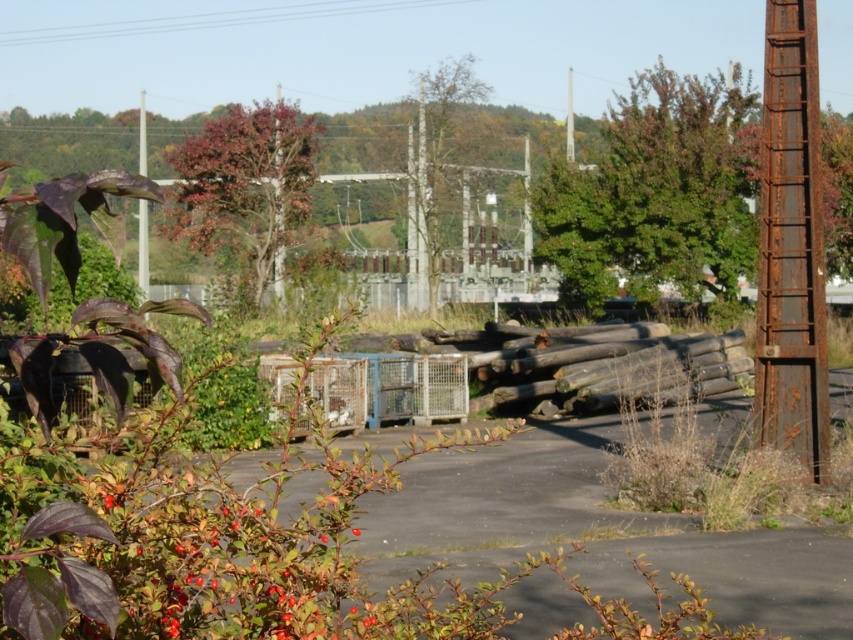
Question: Among these points, which one is farthest from the camera?

Choices:
 (A) (811, 76)
 (B) (233, 108)
 (C) (415, 246)

Answer: (B)

Question: Estimate the real-world distances between objects in this image. Which object is closer to the green leafy tree at center?

Choices:
 (A) rusty metal pole at left
 (B) green leafy tree at upper center
 (C) rusty metal pole at right

Answer: (B)

Question: Is reddish-brown bark tree at center to the right of rusty metal pole at left from the viewer's perspective?

Choices:
 (A) no
 (B) yes

Answer: (B)

Question: Can you confirm if reddish-brown bark tree at center is positioned above green leafy tree at center?

Choices:
 (A) yes
 (B) no

Answer: (B)

Question: Where is rusty metal pole at right located in relation to green leafy tree at center in the image?

Choices:
 (A) below
 (B) above

Answer: (A)

Question: Which point is closer to the camera taking this photo?

Choices:
 (A) (709, 157)
 (B) (138, 104)
 (C) (265, 220)
 (D) (444, 115)

Answer: (A)